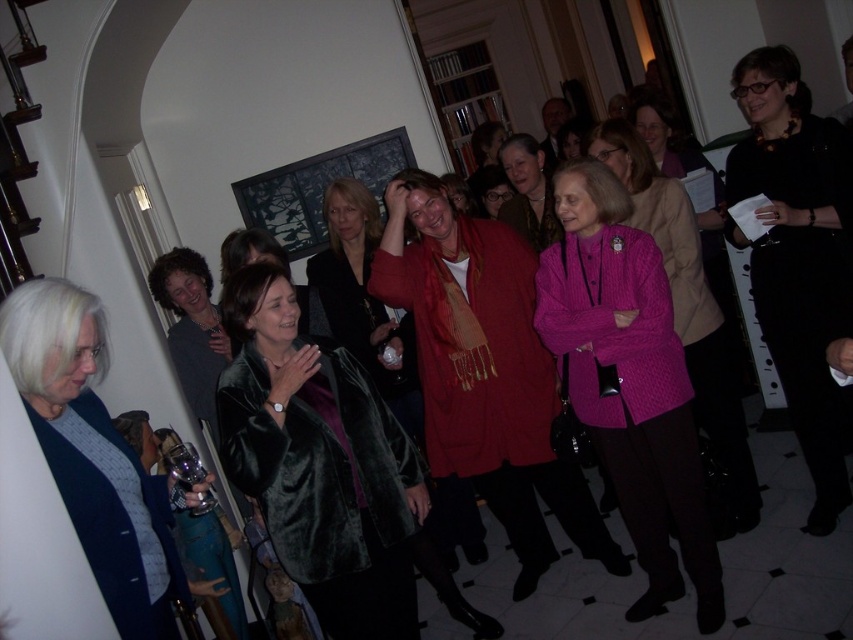
Who is more distant from viewer, (753,499) or (538,160)?

Point (538,160)

Measure the distance between cable-knit sweater at center and camera.

cable-knit sweater at center is 3.04 meters from camera.

Identify the location of cable-knit sweater at center. The width and height of the screenshot is (853, 640). (689, 317).

Does velvet green coat at center appear on the left side of knitted pink sweater at center?

Correct, you'll find velvet green coat at center to the left of knitted pink sweater at center.

Is velvet green coat at center positioned before knitted pink sweater at center?

Yes, velvet green coat at center is closer to the viewer.

Who is more distant from viewer, (355,385) or (532,164)?

Point (532,164)

Identify the location of velvet green coat at center. (318, 461).

Does velvet green coat at center come behind cable-knit sweater at center?

No, it is in front of cable-knit sweater at center.

Is point (253, 314) positioned before point (694, 355)?

Yes, it is.

Where is `velvet green coat at center`? This screenshot has width=853, height=640. velvet green coat at center is located at coordinates (318, 461).